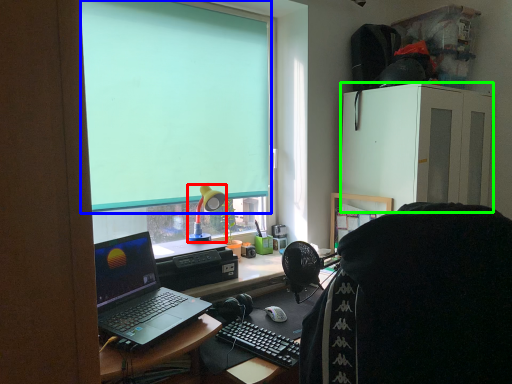
Question: Which object is the closest to the lamp (highlighted by a red box)? Choose among these: projection screen (highlighted by a blue box) or cabinetry (highlighted by a green box).

Choices:
 (A) projection screen
 (B) cabinetry

Answer: (A)